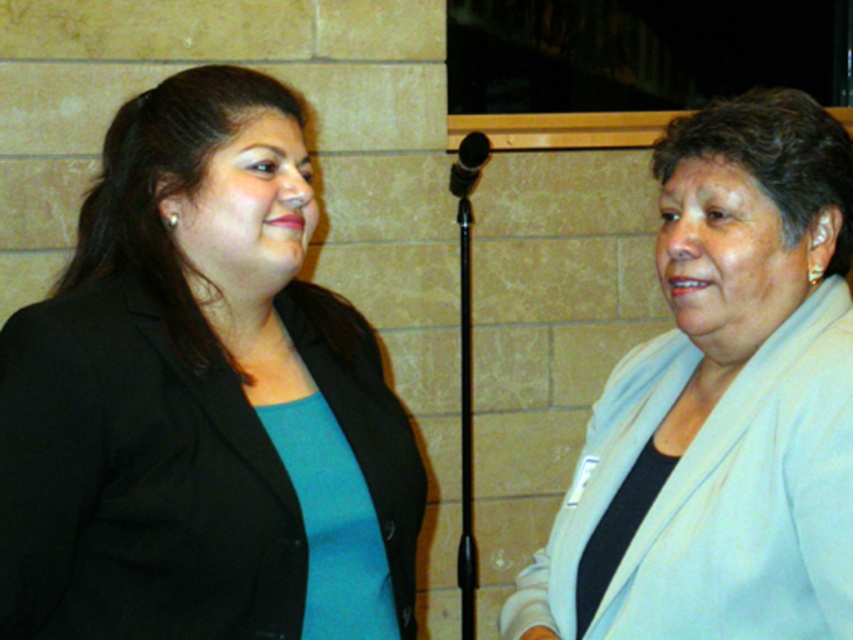
Question: Among these objects, which one is farthest from the camera?

Choices:
 (A) light beige jacket at right
 (B) matte black blazer at left

Answer: (B)

Question: Is matte black blazer at left closer to camera compared to light beige jacket at right?

Choices:
 (A) no
 (B) yes

Answer: (A)

Question: Does matte black blazer at left appear on the left side of light beige jacket at right?

Choices:
 (A) yes
 (B) no

Answer: (A)

Question: Can you confirm if matte black blazer at left is positioned to the right of light beige jacket at right?

Choices:
 (A) yes
 (B) no

Answer: (B)

Question: Which of the following is the farthest from the observer?

Choices:
 (A) matte black blazer at left
 (B) light beige jacket at right

Answer: (A)